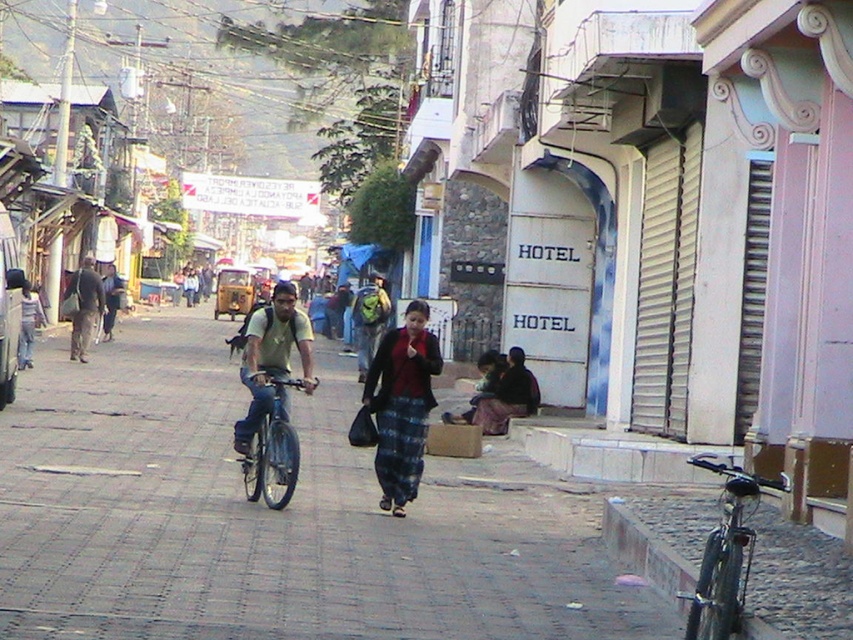
You are standing on the cobblestone street in the scene and notice a dark brown fabric at lower right. Where exactly is this fabric located in relation to the Hotel building?

The dark brown fabric at lower right is located at point (508, 396), which is near the Hotel building on the right side of the street.